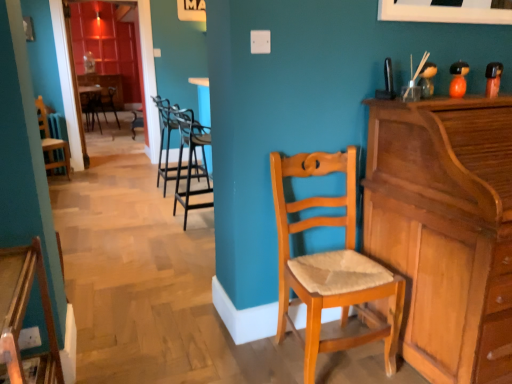
What are the coordinates of `vacant point to the left of black metal barstools at center, marked as the 2th chair in a right-to-left arrangement` in the screenshot? It's located at (147, 221).